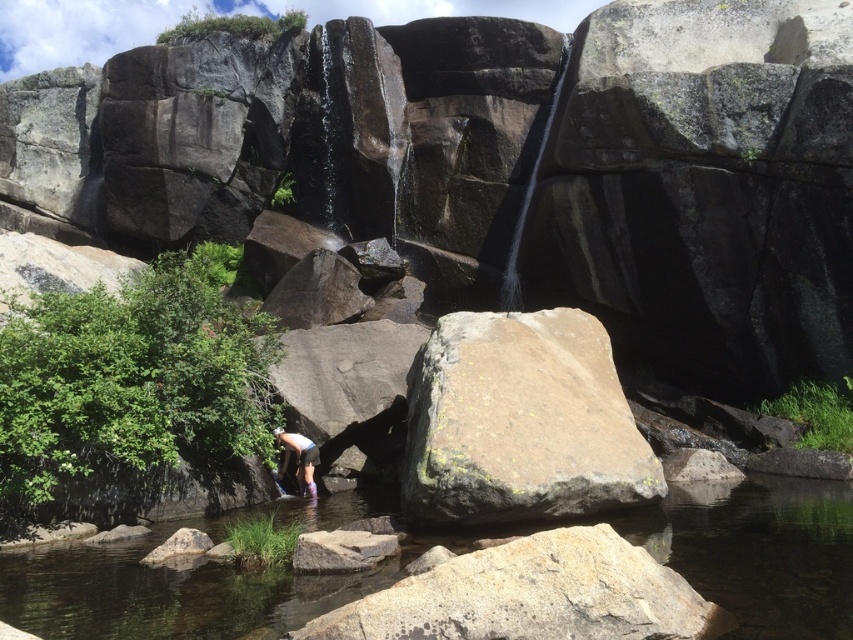
Can you confirm if brown rough rock at center is thinner than white matte shorts at lower center?

Incorrect, brown rough rock at center's width is not less than white matte shorts at lower center's.

Who is lower down, brown rough rock at center or white matte shorts at lower center?

white matte shorts at lower center is lower down.

Where is `brown rough rock at center`? This screenshot has width=853, height=640. brown rough rock at center is located at coordinates (520, 422).

I want to click on brown rough rock at center, so click(520, 422).

From the picture: Is clear water at center to the right of brown rough rock at center from the viewer's perspective?

No, clear water at center is not to the right of brown rough rock at center.

Describe the element at coordinates (201, 579) in the screenshot. I see `clear water at center` at that location.

I want to click on clear water at center, so click(x=201, y=579).

What do you see at coordinates (201, 579) in the screenshot? This screenshot has width=853, height=640. I see `clear water at center` at bounding box center [201, 579].

Is clear water at center bigger than white matte shorts at lower center?

Yes.

The image size is (853, 640). Describe the element at coordinates (201, 579) in the screenshot. I see `clear water at center` at that location.

Identify the location of clear water at center. This screenshot has width=853, height=640. point(201,579).